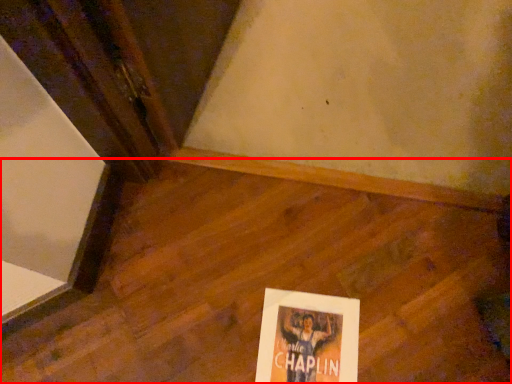
Question: From the image's perspective, what is the correct spatial positioning of plywood (annotated by the red box) in reference to poster?

Choices:
 (A) above
 (B) below

Answer: (A)